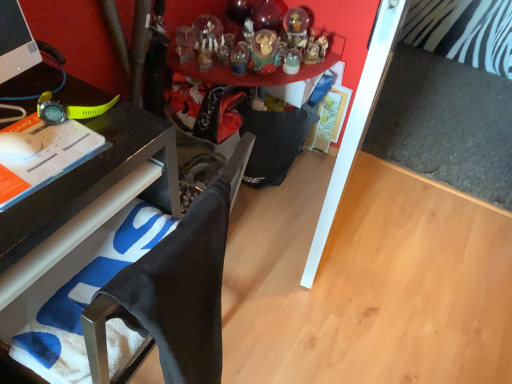
Question: Does matte black watch at left appear on the left side of black fabric computer chair at lower left?

Choices:
 (A) yes
 (B) no

Answer: (A)

Question: Is matte black watch at left smaller than black fabric computer chair at lower left?

Choices:
 (A) no
 (B) yes

Answer: (B)

Question: From the image's perspective, is matte black watch at left under black fabric computer chair at lower left?

Choices:
 (A) yes
 (B) no

Answer: (B)

Question: Is matte black watch at left taller than black fabric computer chair at lower left?

Choices:
 (A) yes
 (B) no

Answer: (B)

Question: Is matte black watch at left to the right of black fabric computer chair at lower left from the viewer's perspective?

Choices:
 (A) no
 (B) yes

Answer: (A)

Question: Does point (286, 21) appear closer or farther from the camera than point (271, 19)?

Choices:
 (A) farther
 (B) closer

Answer: (B)

Question: Considering the positions of translucent glass snow globe at upper center, the second toy when ordered from bottom to top, and translucent glass ornament at upper center, the 1th toy from the top, in the image, is translucent glass snow globe at upper center, the second toy when ordered from bottom to top, bigger or smaller than translucent glass ornament at upper center, the 1th toy from the top,?

Choices:
 (A) small
 (B) big

Answer: (A)

Question: Is translucent glass snow globe at upper center, the 2th toy viewed from the top, situated inside translucent glass ornament at upper center, the 1th toy from the top, or outside?

Choices:
 (A) outside
 (B) inside

Answer: (A)

Question: From the image's perspective, relative to translucent glass ornament at upper center, the 3th toy from the bottom, is translucent glass snow globe at upper center, the 2th toy viewed from the top, above or below?

Choices:
 (A) below
 (B) above

Answer: (A)

Question: Does point (x=264, y=26) appear closer or farther from the camera than point (x=297, y=11)?

Choices:
 (A) closer
 (B) farther

Answer: (A)

Question: In terms of width, does translucent glass ornament at upper center, the 3th toy from the bottom, look wider or thinner when compared to translucent glass snow globe at upper center, the second toy when ordered from bottom to top?

Choices:
 (A) wide
 (B) thin

Answer: (B)

Question: From a real-world perspective, is translucent glass ornament at upper center, the 1th toy from the top, positioned above or below translucent glass snow globe at upper center, the second toy when ordered from bottom to top?

Choices:
 (A) above
 (B) below

Answer: (A)

Question: In terms of size, does translucent glass ornament at upper center, the 3th toy from the bottom, appear bigger or smaller than translucent glass snow globe at upper center, the 2th toy viewed from the top?

Choices:
 (A) small
 (B) big

Answer: (B)

Question: Is matte black watch at left inside the boundaries of translucent glass snow globe at upper center, the 2th toy viewed from the top, or outside?

Choices:
 (A) outside
 (B) inside

Answer: (A)

Question: Does point (58, 114) appear closer or farther from the camera than point (297, 13)?

Choices:
 (A) farther
 (B) closer

Answer: (B)